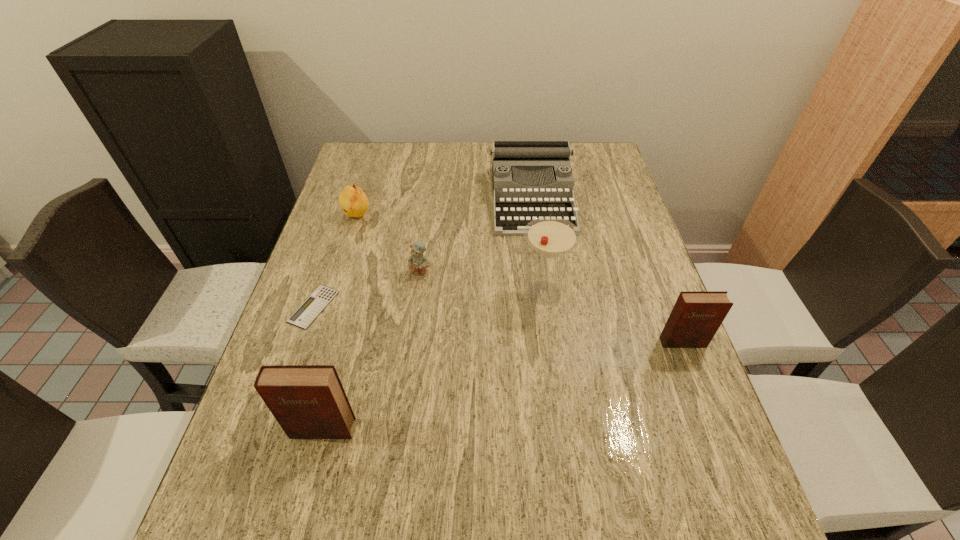
If we want them evenly spaced by inserting an extra diary among them, please locate a free spot for this new diary. Please provide its 2D coordinates. Your answer should be formatted as a tuple, i.e. [(x, y)], where the tuple contains the x and y coordinates of a point satisfying the conditions above.

[(516, 382)]